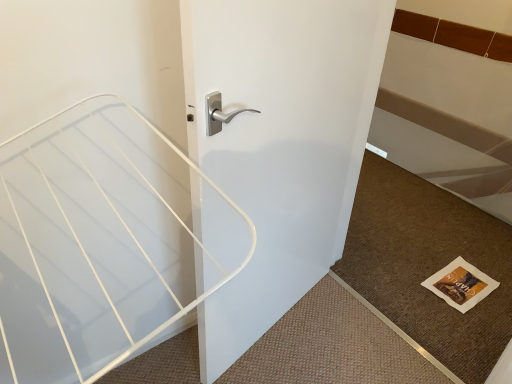
Question: Do you think white glossy door handle at center is within brown textured mat at lower right, or outside of it?

Choices:
 (A) outside
 (B) inside

Answer: (A)

Question: Is white glossy door handle at center wider or thinner than brown textured mat at lower right?

Choices:
 (A) wide
 (B) thin

Answer: (B)

Question: From a real-world perspective, is white glossy door handle at center physically located above or below brown textured mat at lower right?

Choices:
 (A) below
 (B) above

Answer: (B)

Question: From a real-world perspective, is brown textured mat at lower right positioned above or below white glossy door handle at center?

Choices:
 (A) above
 (B) below

Answer: (B)

Question: From the image's perspective, is brown textured mat at lower right located above or below white glossy door handle at center?

Choices:
 (A) above
 (B) below

Answer: (B)

Question: Does point (488, 231) appear closer or farther from the camera than point (368, 86)?

Choices:
 (A) farther
 (B) closer

Answer: (A)

Question: From their relative heights in the image, would you say brown textured mat at lower right is taller or shorter than white glossy door handle at center?

Choices:
 (A) short
 (B) tall

Answer: (A)